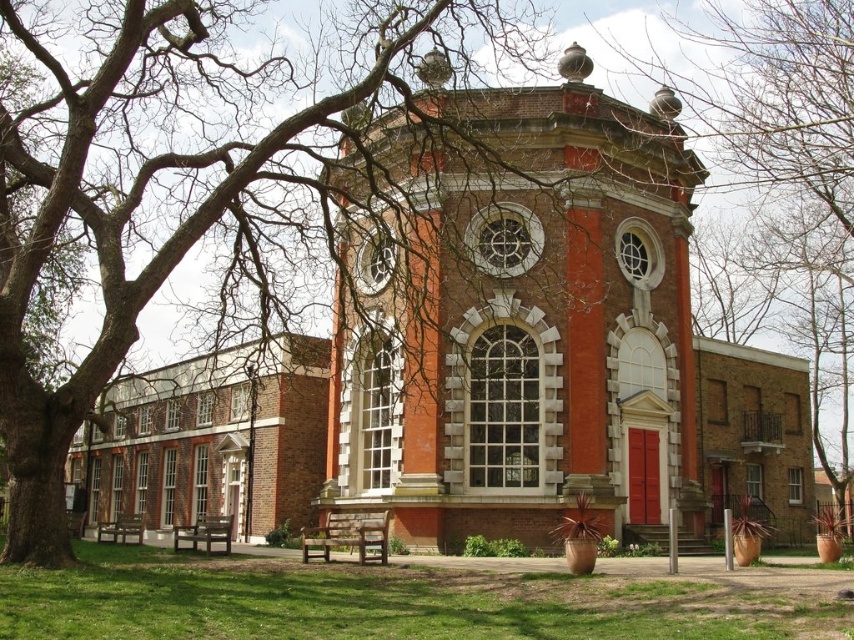
Question: Considering the relative positions of bare branches at upper left and bare branches at center in the image provided, where is bare branches at upper left located with respect to bare branches at center?

Choices:
 (A) below
 (B) above

Answer: (B)

Question: Does bare branches at upper left have a smaller size compared to bare branches at center?

Choices:
 (A) yes
 (B) no

Answer: (B)

Question: From the image, what is the correct spatial relationship of bare branches at upper left in relation to bare branches at center?

Choices:
 (A) left
 (B) right

Answer: (A)

Question: Among these points, which one is farthest from the camera?

Choices:
 (A) (826, 45)
 (B) (41, 209)

Answer: (A)

Question: Which point is closer to the camera taking this photo?

Choices:
 (A) (32, 508)
 (B) (658, 68)

Answer: (A)